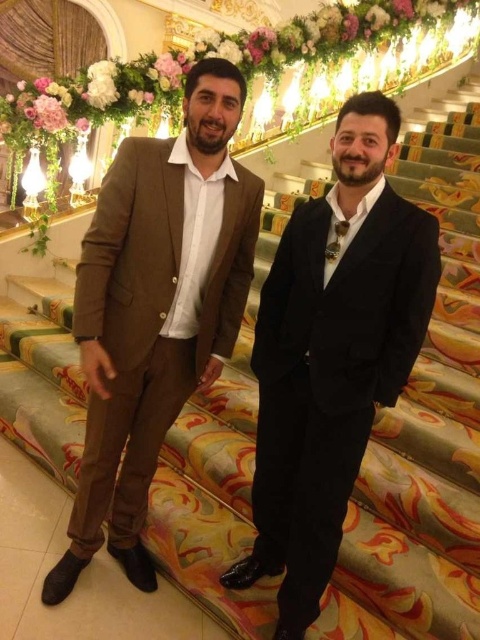
Who is positioned more to the right, black satin suit at center or matte brown suit at center?

black satin suit at center is more to the right.

Does black satin suit at center appear on the left side of matte brown suit at center?

Incorrect, black satin suit at center is not on the left side of matte brown suit at center.

Where is `black satin suit at center`? This screenshot has width=480, height=640. black satin suit at center is located at coordinates (332, 355).

Locate an element on the screen. The image size is (480, 640). black satin suit at center is located at coordinates (332, 355).